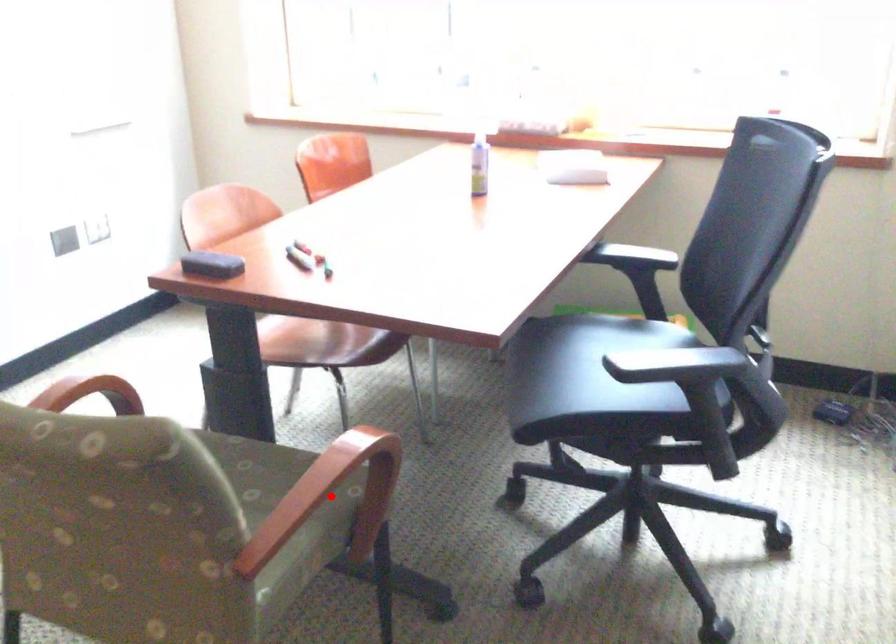
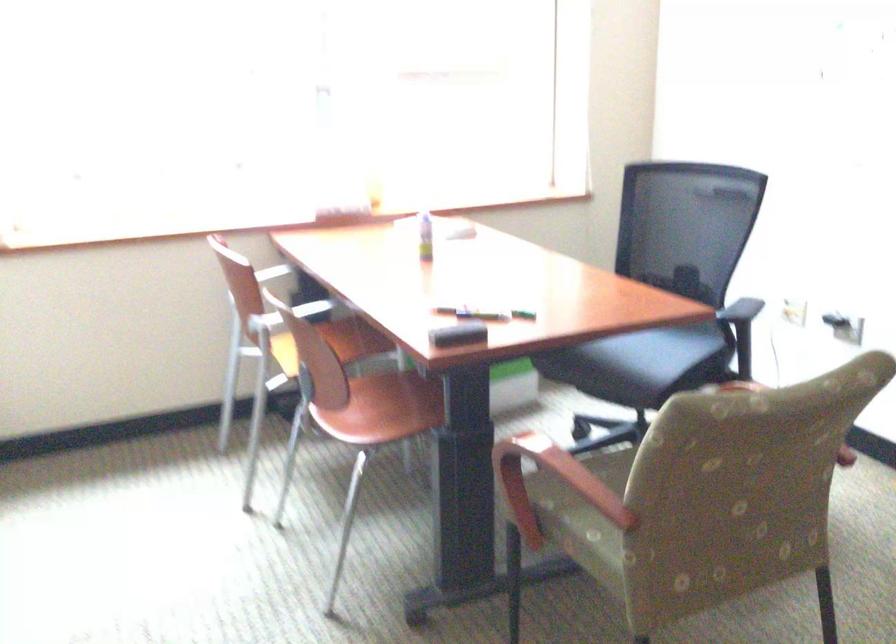
Question: I am providing you with two images of the same scene from different viewpoints. A red point is marked on the first image. Can you still see the location of the red point in image 2?

Choices:
 (A) Yes
 (B) No

Answer: (B)